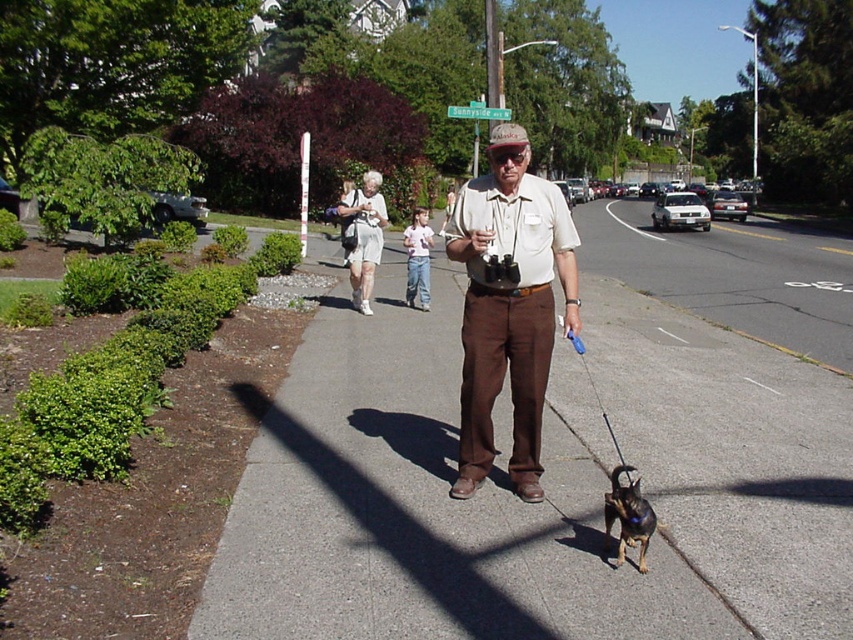
Which of these two, gray asphalt sidewalk at center or shiny brown dog at lower center, stands shorter?

With less height is shiny brown dog at lower center.

Is point (694, 316) positioned behind point (624, 534)?

That is True.

What do you see at coordinates (556, 461) in the screenshot? I see `gray asphalt sidewalk at center` at bounding box center [556, 461].

Where is `gray asphalt sidewalk at center`? This screenshot has height=640, width=853. gray asphalt sidewalk at center is located at coordinates (556, 461).

Who is positioned more to the left, matte khaki shirt at center or shiny brown dog at lower center?

matte khaki shirt at center

From the picture: Can you confirm if matte khaki shirt at center is positioned above shiny brown dog at lower center?

Yes.

Locate an element on the screen. matte khaki shirt at center is located at coordinates [x=509, y=305].

Is point (798, 324) positioned behind point (468, 243)?

That is True.

Can you confirm if gray asphalt sidewalk at center is wider than matte khaki shirt at center?

Yes.

Between point (801, 252) and point (474, 225), which one is positioned behind?

The point (801, 252) is behind.

You are a GUI agent. You are given a task and a screenshot of the screen. Output one action in this format:
    pyautogui.click(x=<x>, y=<y>)
    Task: Click on the gray asphalt sidewalk at center
    This screenshot has height=640, width=853.
    Given the screenshot: What is the action you would take?
    pyautogui.click(x=556, y=461)